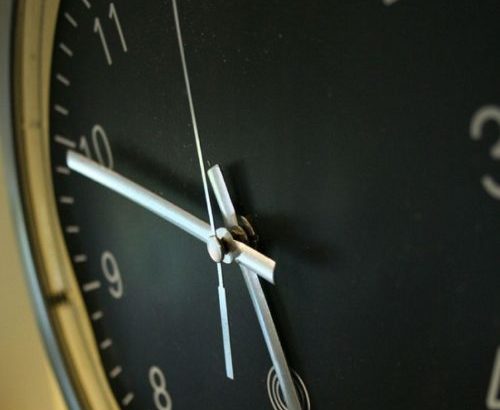
At what (x,y) coordinates should I click in order to perform the action: click on clock side view. Please return your answer as a coordinate pair (x, y). Looking at the image, I should click on (156, 301).